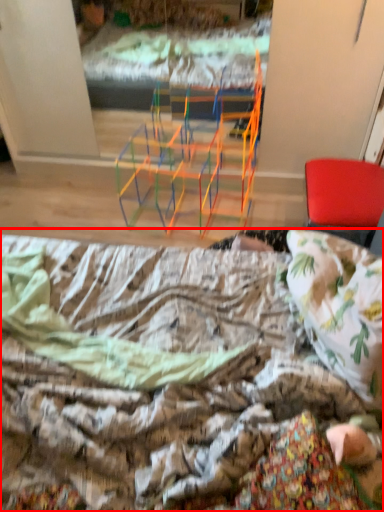
Question: From the image, what is the correct spatial relationship of bed (annotated by the red box) in relation to chair?

Choices:
 (A) left
 (B) right

Answer: (A)